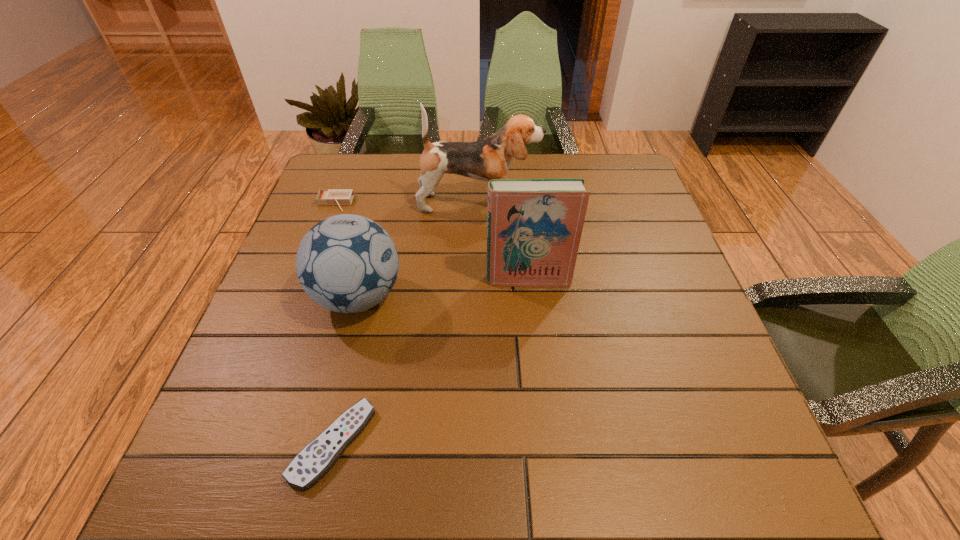
In the image, there is a desktop. Find the location of `blank space at the left edge`. blank space at the left edge is located at coordinates (259, 361).

Where is `vacant area at the right edge of the desktop`? vacant area at the right edge of the desktop is located at coordinates (727, 429).

Locate an element on the screen. The height and width of the screenshot is (540, 960). vacant region at the far right corner of the desktop is located at coordinates (645, 196).

Identify the location of vacant space at the near right corner. This screenshot has height=540, width=960. (732, 500).

Identify the location of free space between the soccer ball and the hardback book. The height and width of the screenshot is (540, 960). click(x=444, y=288).

Identify the location of vacant space that's between the third tallest object and the nearest object. This screenshot has height=540, width=960. (346, 370).

The height and width of the screenshot is (540, 960). I want to click on free space that is in between the soccer ball and the puppy, so click(x=419, y=250).

Locate an element on the screen. The image size is (960, 540). free space between the puppy and the shortest object is located at coordinates (406, 323).

Where is `vacant space that's between the puppy and the nearest object`? vacant space that's between the puppy and the nearest object is located at coordinates (406, 323).

Find the location of a particular element. vacant point located between the matchbox and the puppy is located at coordinates (406, 203).